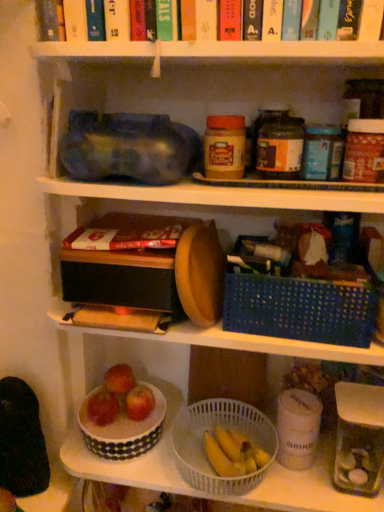
Question: Considering the relative positions of shiny red apple at lower center, the 2th apple from the right, and red matte apple at lower center, the first apple when ordered from left to right, in the image provided, is shiny red apple at lower center, the 2th apple from the right, to the right of red matte apple at lower center, the first apple when ordered from left to right, from the viewer's perspective?

Choices:
 (A) no
 (B) yes

Answer: (B)

Question: Is shiny red apple at lower center, placed as the 2th apple when sorted from left to right, smaller than red matte apple at lower center, the first apple when ordered from left to right?

Choices:
 (A) yes
 (B) no

Answer: (A)

Question: Are shiny red apple at lower center, the 2th apple from the right, and red matte apple at lower center, the first apple when ordered from left to right, making contact?

Choices:
 (A) no
 (B) yes

Answer: (B)

Question: From the image's perspective, is shiny red apple at lower center, placed as the 2th apple when sorted from left to right, over red matte apple at lower center, the first apple when ordered from left to right?

Choices:
 (A) yes
 (B) no

Answer: (A)

Question: Considering the relative sizes of shiny red apple at lower center, placed as the 2th apple when sorted from left to right, and red matte apple at lower center, the first apple when ordered from left to right, in the image provided, is shiny red apple at lower center, placed as the 2th apple when sorted from left to right, shorter than red matte apple at lower center, the first apple when ordered from left to right,?

Choices:
 (A) yes
 (B) no

Answer: (A)

Question: From the image's perspective, is white dotted bowl at lower left above or below white polka dot bowl at lower center?

Choices:
 (A) above
 (B) below

Answer: (A)

Question: Relative to white polka dot bowl at lower center, is white dotted bowl at lower left in front or behind?

Choices:
 (A) behind
 (B) front

Answer: (A)

Question: In the image, is white dotted bowl at lower left on the left side or the right side of white polka dot bowl at lower center?

Choices:
 (A) left
 (B) right

Answer: (A)

Question: Considering the positions of point (112, 434) and point (82, 381), is point (112, 434) closer or farther from the camera than point (82, 381)?

Choices:
 (A) closer
 (B) farther

Answer: (A)

Question: From a real-world perspective, is matte plastic peanut butter jar at center above or below white plastic basket at lower center, positioned as the first basket in bottom-to-top order?

Choices:
 (A) above
 (B) below

Answer: (A)

Question: Considering their positions, is matte plastic peanut butter jar at center located in front of or behind white plastic basket at lower center, positioned as the first basket in bottom-to-top order?

Choices:
 (A) front
 (B) behind

Answer: (A)

Question: Is point (231, 131) positioned closer to the camera than point (210, 404)?

Choices:
 (A) closer
 (B) farther

Answer: (A)

Question: From the image's perspective, is matte plastic peanut butter jar at center above or below white plastic basket at lower center, positioned as the first basket in bottom-to-top order?

Choices:
 (A) below
 (B) above

Answer: (B)

Question: Choose the correct answer: Is shiny red apple at lower center, the 2th apple from the right, inside red matte apple at lower center, the first apple when ordered from left to right, or outside it?

Choices:
 (A) inside
 (B) outside

Answer: (B)

Question: In terms of height, does shiny red apple at lower center, the 2th apple from the right, look taller or shorter compared to red matte apple at lower center, which is the third apple from right to left?

Choices:
 (A) short
 (B) tall

Answer: (A)